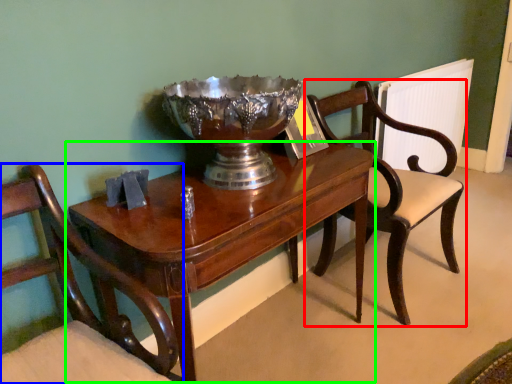
Question: Which object is the closest to the chair (highlighted by a red box)? Choose among these: chair (highlighted by a blue box) or table (highlighted by a green box).

Choices:
 (A) chair
 (B) table

Answer: (B)